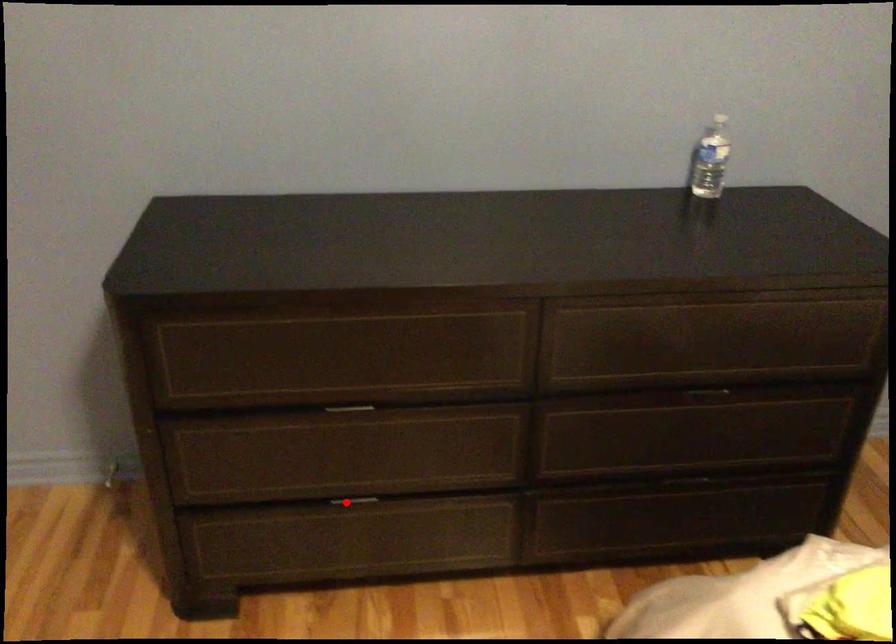
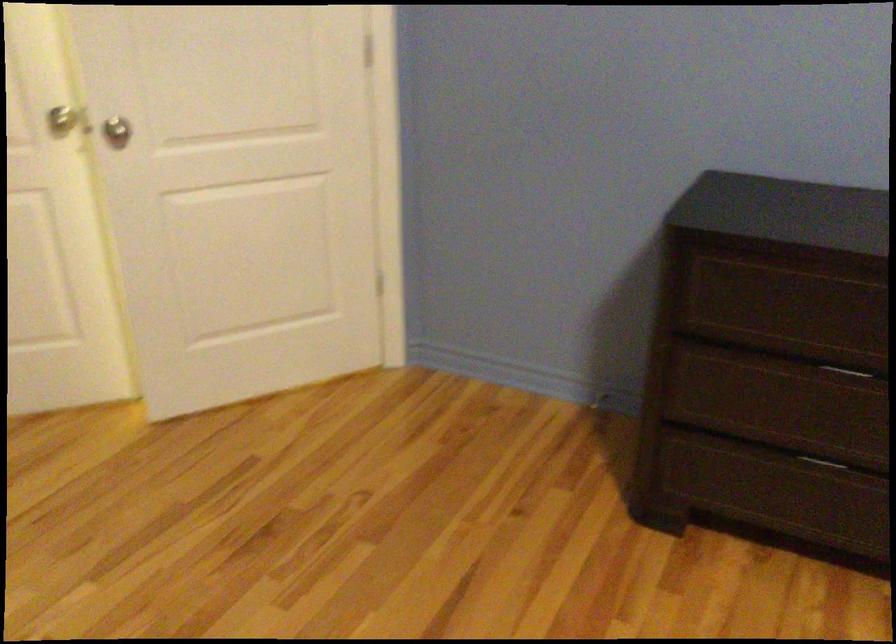
Question: I am providing you with two images of the same scene from different viewpoints. A red point is marked on the first image. Can you still see the location of the red point in image 2?

Choices:
 (A) Yes
 (B) No

Answer: (A)